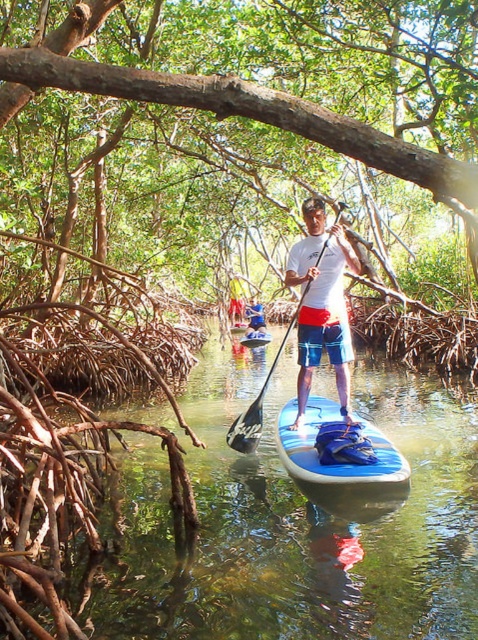
You are planning to take a paddleboard through the narrow waterway in the image. You have two options available to you, the blue glossy paddleboard at center and the white matte paddleboard at center. Considering the narrowness of the waterway, which paddleboard would be easier to maneuver?

The blue glossy paddleboard at center is shorter than the white matte paddleboard at center, making it easier to maneuver in the narrow waterway.

You are a photographer trying to capture the paddleboarder in the waterway. Since you want to highlight both the blue glossy paddleboard at center and the white matte paddleboard at center in your shot, which one should you focus on first to ensure they are both in frame?

The blue glossy paddleboard at center is located below the white matte paddleboard at center, so you should focus on the white matte paddleboard at center first to ensure both are in frame.

Consider the image. You are a photographer standing on the shore of a mangrove waterway. You want to take a photo of the white matte paddleboard at center from a distance that allows you to capture the entire board in the frame without any distortion. The camera you are using has a focal length of 50mm and a sensor size that requires a minimum distance of 5 meters to avoid distortion for objects of this size. Can you take the photo without distortion?

The white matte paddleboard at center and camera are 5.18 meters apart from each other. Since the required minimum distance is 5 meters, the photographer can take the photo without distortion as the distance is sufficient.